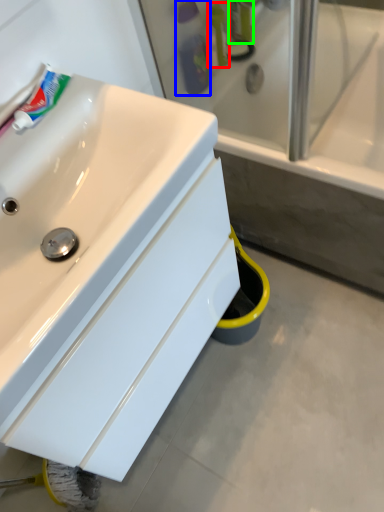
Question: Considering the real-world distances, which object is closest to mouthwash (highlighted by a red box)? toiletry (highlighted by a blue box) or toiletry (highlighted by a green box).

Choices:
 (A) toiletry
 (B) toiletry

Answer: (A)